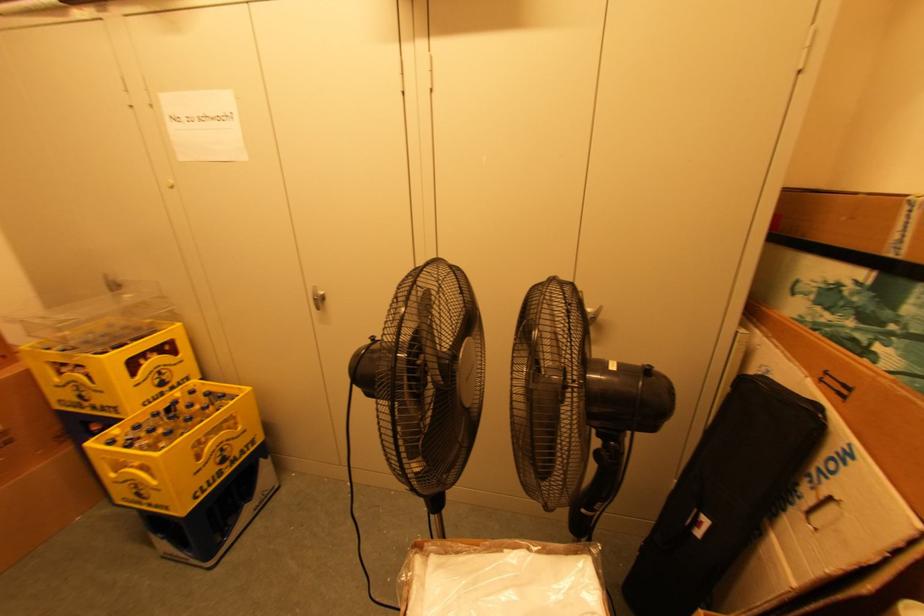
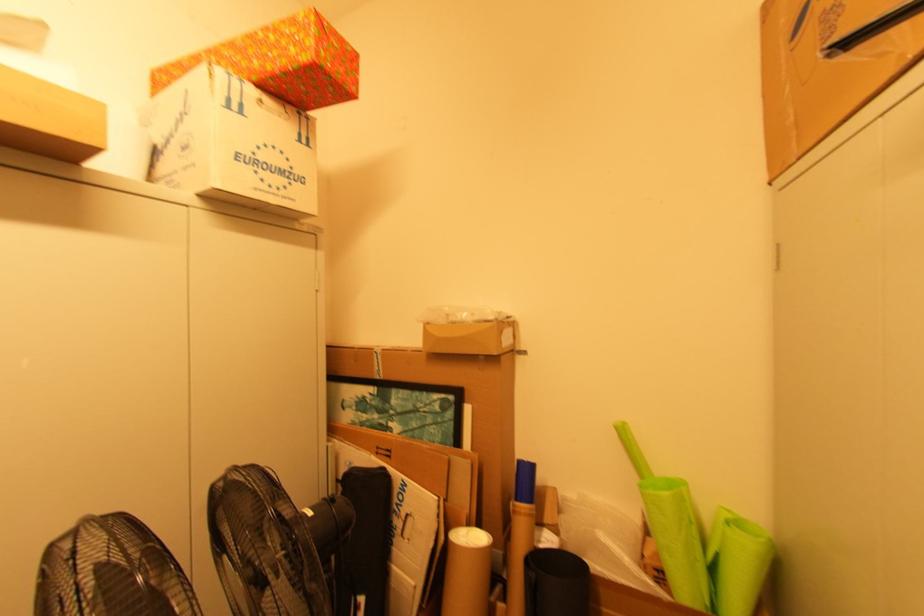
Question: The camera is either moving clockwise (left) or counter-clockwise (right) around the object. The first image is from the beginning of the video and the second image is from the end. Is the camera moving left or right when shooting the video?

Choices:
 (A) Left
 (B) Right

Answer: (A)